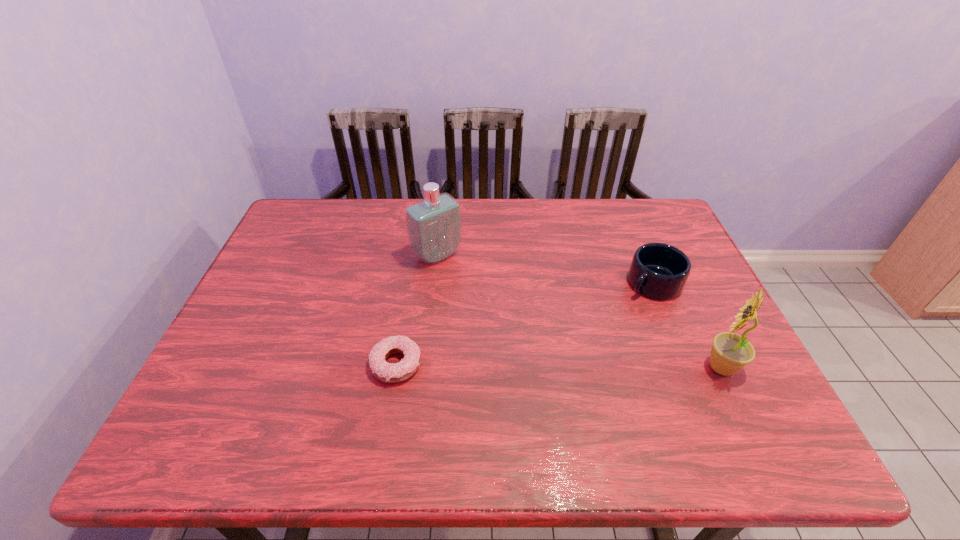
Where is `the shortest object`? The height and width of the screenshot is (540, 960). the shortest object is located at coordinates (389, 373).

Find the location of a particular element. sunflower is located at coordinates (730, 352).

I want to click on mug, so click(x=660, y=271).

Where is `perfume`? perfume is located at coordinates (434, 225).

Find the location of a particular element. This screenshot has width=960, height=540. free spot located 0.130m on the back of the doughnut is located at coordinates (406, 306).

Where is `free space located 0.280m on the face of the sunflower`? free space located 0.280m on the face of the sunflower is located at coordinates (582, 367).

You are a GUI agent. You are given a task and a screenshot of the screen. Output one action in this format:
    pyautogui.click(x=<x>, y=<y>)
    Task: Click on the blank space located on the face of the sunflower
    The width and height of the screenshot is (960, 540).
    Given the screenshot: What is the action you would take?
    pyautogui.click(x=560, y=367)

Image resolution: width=960 pixels, height=540 pixels. In order to click on blank space located on the face of the sunflower in this screenshot , I will do `click(560, 367)`.

Locate an element on the screen. The width and height of the screenshot is (960, 540). vacant region located 0.080m with the handle on the side of the second shortest object is located at coordinates pos(619,309).

At what (x,y) coordinates should I click in order to perform the action: click on free space located with the handle on the side of the second shortest object. Please return your answer as a coordinate pair (x, y). The height and width of the screenshot is (540, 960). Looking at the image, I should click on (569, 349).